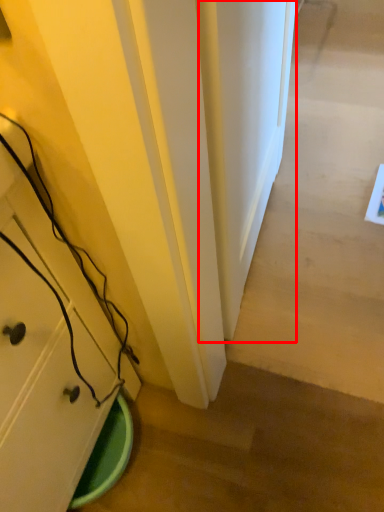
Question: Considering the relative positions of door (annotated by the red box) and cabinetry in the image provided, where is door (annotated by the red box) located with respect to the staircase?

Choices:
 (A) left
 (B) right

Answer: (B)